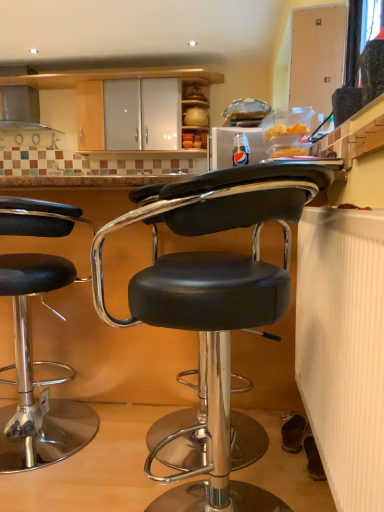
What do you see at coordinates (33, 374) in the screenshot? I see `black leather stool at left, which ranks as the 2th chair in front-to-back order` at bounding box center [33, 374].

I want to click on black leather stool at left, which ranks as the 2th chair in front-to-back order, so click(x=33, y=374).

Is black leather stool at left, which ranks as the 2th chair in front-to-back order, oriented away from black leather stool at center, which is the 1th chair in right-to-left order?

No, black leather stool at center, which is the 1th chair in right-to-left order, is not at the back of black leather stool at left, which ranks as the 2th chair in front-to-back order.

Can you confirm if black leather stool at left, which ranks as the 2th chair in front-to-back order, is bigger than black leather stool at center, which is the 2th chair from left to right?

Incorrect, black leather stool at left, which ranks as the 2th chair in front-to-back order, is not larger than black leather stool at center, which is the 2th chair from left to right.

Is the depth of black leather stool at left, which is the 1th chair in back-to-front order, greater than that of black leather stool at center, arranged as the 1th chair when viewed from the front?

Yes, black leather stool at left, which is the 1th chair in back-to-front order, is behind black leather stool at center, arranged as the 1th chair when viewed from the front.

Based on the photo, is there a large distance between black leather stool at left, acting as the 2th chair starting from the right, and black leather stool at center, which is the 2th chair from left to right?

black leather stool at left, acting as the 2th chair starting from the right, is actually quite close to black leather stool at center, which is the 2th chair from left to right.

Is satin silver exhaust hood at upper left positioned far away from black leather stool at left, placed as the 1th chair when sorted from left to right?

Absolutely, satin silver exhaust hood at upper left is distant from black leather stool at left, placed as the 1th chair when sorted from left to right.

How different are the orientations of satin silver exhaust hood at upper left and black leather stool at left, placed as the 1th chair when sorted from left to right, in degrees?

satin silver exhaust hood at upper left and black leather stool at left, placed as the 1th chair when sorted from left to right, are facing 179 degrees away from each other.

Would you say satin silver exhaust hood at upper left contains black leather stool at left, which ranks as the 2th chair in front-to-back order?

No, black leather stool at left, which ranks as the 2th chair in front-to-back order, is located outside of satin silver exhaust hood at upper left.

From a real-world perspective, is black leather stool at center, the 2th chair positioned from the back, below black leather stool at left, acting as the 2th chair starting from the right?

No, from a real-world perspective, black leather stool at center, the 2th chair positioned from the back, is not below black leather stool at left, acting as the 2th chair starting from the right.

Find the location of a particular element. chair behind the black leather stool at center, which is the 2th chair from left to right is located at coordinates (33, 374).

Which object is closer to the camera, black leather stool at center, which is the 2th chair from left to right, or black leather stool at left, acting as the 2th chair starting from the right?

black leather stool at center, which is the 2th chair from left to right, is closer to the camera.

In the scene shown: Between black leather stool at center, arranged as the 1th chair when viewed from the front, and black leather stool at left, which is the 1th chair in back-to-front order, which one has less height?

black leather stool at left, which is the 1th chair in back-to-front order, is shorter.

Considering the relative sizes of black leather stool at center, the 2th chair positioned from the back, and satin silver exhaust hood at upper left in the image provided, is black leather stool at center, the 2th chair positioned from the back, wider than satin silver exhaust hood at upper left?

Yes.

Is point (229, 327) in front of point (23, 118)?

That is True.

From the image's perspective, is black leather stool at center, which is the 2th chair from left to right, located above satin silver exhaust hood at upper left?

Actually, black leather stool at center, which is the 2th chair from left to right, appears below satin silver exhaust hood at upper left in the image.

Considering the positions of objects black leather stool at center, arranged as the 1th chair when viewed from the front, and satin silver exhaust hood at upper left in the image provided, who is more to the left, black leather stool at center, arranged as the 1th chair when viewed from the front, or satin silver exhaust hood at upper left?

Positioned to the left is satin silver exhaust hood at upper left.

Considering the positions of objects black leather stool at left, which is the 1th chair in back-to-front order, and satin silver exhaust hood at upper left in the image provided, who is behind, black leather stool at left, which is the 1th chair in back-to-front order, or satin silver exhaust hood at upper left?

satin silver exhaust hood at upper left.

From the image's perspective, is black leather stool at left, which is the 1th chair in back-to-front order, positioned above or below satin silver exhaust hood at upper left?

black leather stool at left, which is the 1th chair in back-to-front order, is below satin silver exhaust hood at upper left.

Considering the relative sizes of black leather stool at left, which ranks as the 2th chair in front-to-back order, and satin silver exhaust hood at upper left in the image provided, is black leather stool at left, which ranks as the 2th chair in front-to-back order, thinner than satin silver exhaust hood at upper left?

No, black leather stool at left, which ranks as the 2th chair in front-to-back order, is not thinner than satin silver exhaust hood at upper left.

Find the location of a particular element. The image size is (384, 512). exhaust hood above the black leather stool at left, which ranks as the 2th chair in front-to-back order (from a real-world perspective) is located at coordinates (21, 108).

Who is bigger, satin silver exhaust hood at upper left or black leather stool at center, the 2th chair positioned from the back?

black leather stool at center, the 2th chair positioned from the back, is bigger.

From the image's perspective, is satin silver exhaust hood at upper left above or below black leather stool at center, which is the 1th chair in right-to-left order?

satin silver exhaust hood at upper left is situated higher than black leather stool at center, which is the 1th chair in right-to-left order, in the image.

Does satin silver exhaust hood at upper left turn towards black leather stool at center, the 2th chair positioned from the back?

No, satin silver exhaust hood at upper left is not facing towards black leather stool at center, the 2th chair positioned from the back.

Between point (24, 88) and point (190, 315), which one is positioned behind?

Positioned behind is point (24, 88).

The image size is (384, 512). In order to click on chair above the black leather stool at left, placed as the 1th chair when sorted from left to right (from a real-world perspective) in this screenshot , I will do `click(215, 301)`.

Where is `chair that is the 1st one when counting forward from the satin silver exhaust hood at upper left`? chair that is the 1st one when counting forward from the satin silver exhaust hood at upper left is located at coordinates (33, 374).

Looking at the image, which one is located further to black leather stool at center, the 2th chair positioned from the back, black leather stool at left, which is the 1th chair in back-to-front order, or satin silver exhaust hood at upper left?

satin silver exhaust hood at upper left lies further to black leather stool at center, the 2th chair positioned from the back, than the other object.

When comparing their distances from satin silver exhaust hood at upper left, does black leather stool at left, acting as the 2th chair starting from the right, or black leather stool at center, which is the 2th chair from left to right, seem further?

The object further to satin silver exhaust hood at upper left is black leather stool at center, which is the 2th chair from left to right.

When comparing their distances from black leather stool at left, placed as the 1th chair when sorted from left to right, does satin silver exhaust hood at upper left or black leather stool at center, the 2th chair positioned from the back, seem closer?

black leather stool at center, the 2th chair positioned from the back, lies closer to black leather stool at left, placed as the 1th chair when sorted from left to right, than the other object.

Which object lies nearer to the anchor point black leather stool at center, which is the 1th chair in right-to-left order, satin silver exhaust hood at upper left or black leather stool at left, placed as the 1th chair when sorted from left to right?

black leather stool at left, placed as the 1th chair when sorted from left to right.

Looking at the image, which one is located further to satin silver exhaust hood at upper left, black leather stool at center, the 2th chair positioned from the back, or black leather stool at left, which is the 1th chair in back-to-front order?

The object further to satin silver exhaust hood at upper left is black leather stool at center, the 2th chair positioned from the back.

Based on their spatial positions, is black leather stool at center, arranged as the 1th chair when viewed from the front, or satin silver exhaust hood at upper left further from black leather stool at left, acting as the 2th chair starting from the right?

satin silver exhaust hood at upper left lies further to black leather stool at left, acting as the 2th chair starting from the right, than the other object.

You are a GUI agent. You are given a task and a screenshot of the screen. Output one action in this format:
    pyautogui.click(x=<x>, y=<y>)
    Task: Click on the chair between black leather stool at center, the 2th chair positioned from the back, and satin silver exhaust hood at upper left from front to back
    This screenshot has width=384, height=512.
    Given the screenshot: What is the action you would take?
    pyautogui.click(x=33, y=374)